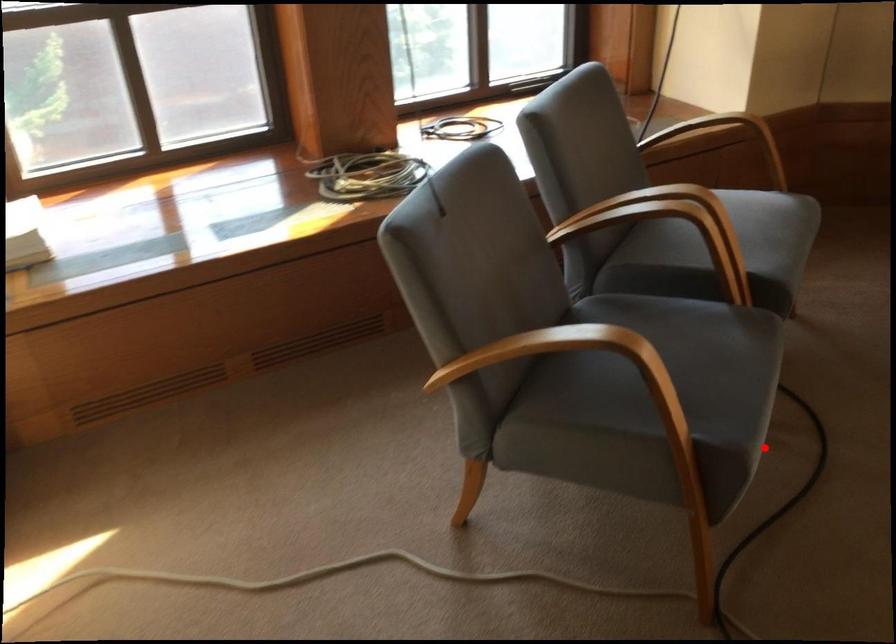
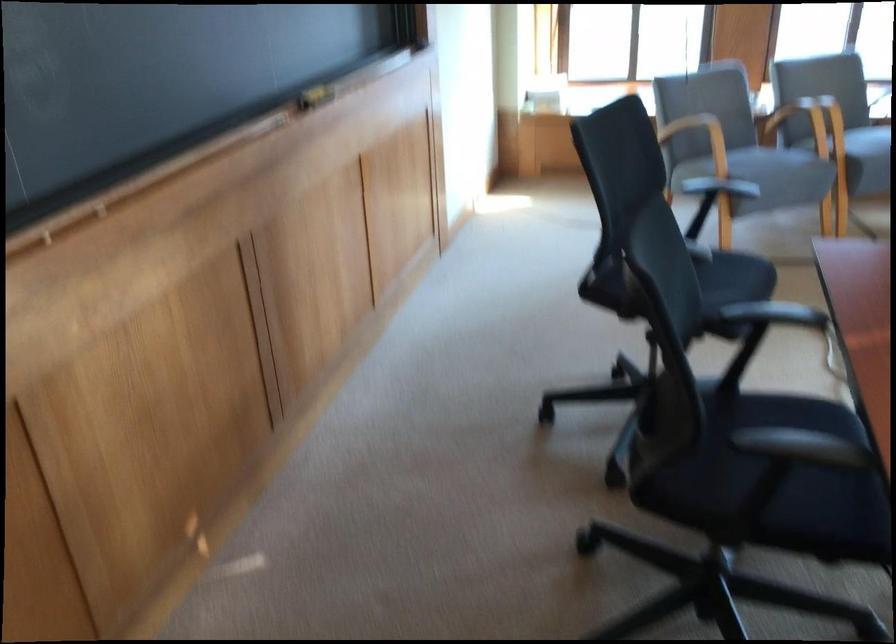
Locate, in the second image, the point that corresponds to the highlighted location in the first image.

(769, 172)